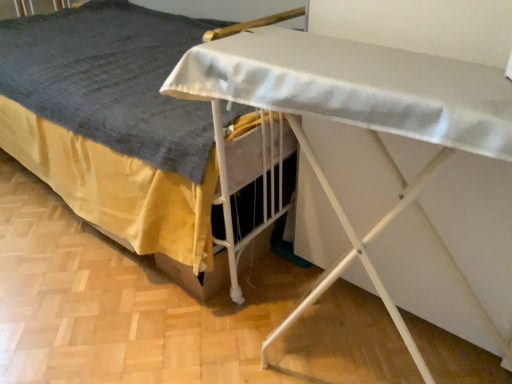
This screenshot has width=512, height=384. I want to click on white matte ironing board at lower center, so click(x=352, y=95).

What do you see at coordinates (352, 95) in the screenshot? The image size is (512, 384). I see `white matte ironing board at lower center` at bounding box center [352, 95].

What do you see at coordinates (116, 131) in the screenshot?
I see `white fabric bed at center` at bounding box center [116, 131].

You are a GUI agent. You are given a task and a screenshot of the screen. Output one action in this format:
    pyautogui.click(x=<x>, y=<y>)
    Task: Click on the white fabric bed at center
    The width and height of the screenshot is (512, 384).
    Given the screenshot: What is the action you would take?
    pyautogui.click(x=116, y=131)

I want to click on white matte ironing board at lower center, so click(352, 95).

Considering the positions of objects white matte ironing board at lower center and white fabric bed at center in the image provided, who is more to the left, white matte ironing board at lower center or white fabric bed at center?

From the viewer's perspective, white fabric bed at center appears more on the left side.

From the picture: In the image, is white matte ironing board at lower center positioned in front of or behind white fabric bed at center?

In the image, white matte ironing board at lower center appears in front of white fabric bed at center.

Does point (364, 240) appear closer or farther from the camera than point (161, 195)?

Point (364, 240) is positioned closer to the camera compared to point (161, 195).

From the image's perspective, which object appears higher, white matte ironing board at lower center or white fabric bed at center?

white fabric bed at center, from the image's perspective.

From a real-world perspective, between white matte ironing board at lower center and white fabric bed at center, who is vertically higher?

white fabric bed at center is physically above.

Does white matte ironing board at lower center have a lesser width compared to white fabric bed at center?

No, white matte ironing board at lower center is not thinner than white fabric bed at center.

From their relative heights in the image, would you say white matte ironing board at lower center is taller or shorter than white fabric bed at center?

white matte ironing board at lower center is shorter than white fabric bed at center.

Considering the sizes of objects white matte ironing board at lower center and white fabric bed at center in the image provided, who is smaller, white matte ironing board at lower center or white fabric bed at center?

With smaller size is white matte ironing board at lower center.

Is white matte ironing board at lower center located outside white fabric bed at center?

No, white matte ironing board at lower center is not entirely external to white fabric bed at center.

Is white matte ironing board at lower center directly adjacent to white fabric bed at center?

No, white matte ironing board at lower center is not beside white fabric bed at center.

Is white matte ironing board at lower center facing away from white fabric bed at center?

That's right, white matte ironing board at lower center is facing away from white fabric bed at center.

I want to click on table that is below the white fabric bed at center (from the image's perspective), so click(352, 95).

Which object is positioned more to the right, white fabric bed at center or white matte ironing board at lower center?

Positioned to the right is white matte ironing board at lower center.

Which object is closer to the camera, white fabric bed at center or white matte ironing board at lower center?

white matte ironing board at lower center is more forward.

Which is in front, point (233, 294) or point (242, 26)?

Positioned in front is point (242, 26).

From the image's perspective, does white fabric bed at center appear higher than white matte ironing board at lower center?

Indeed, from the image's perspective, white fabric bed at center is shown above white matte ironing board at lower center.

From a real-world perspective, which is physically below, white fabric bed at center or white matte ironing board at lower center?

white matte ironing board at lower center is physically lower.

Considering the relative sizes of white fabric bed at center and white matte ironing board at lower center in the image provided, is white fabric bed at center wider than white matte ironing board at lower center?

No, white fabric bed at center is not wider than white matte ironing board at lower center.

Between white fabric bed at center and white matte ironing board at lower center, which one has less height?

white matte ironing board at lower center is shorter.

Which of these two, white fabric bed at center or white matte ironing board at lower center, is smaller?

white matte ironing board at lower center is smaller.

Does white fabric bed at center contain white matte ironing board at lower center?

Yes, white matte ironing board at lower center is inside white fabric bed at center.

Would you say white fabric bed at center is a long distance from white matte ironing board at lower center?

That's not correct — white fabric bed at center is a little close to white matte ironing board at lower center.

Is white fabric bed at center facing away from white matte ironing board at lower center?

No, white fabric bed at center is not facing away from white matte ironing board at lower center.

Find the location of a particular element. The height and width of the screenshot is (384, 512). bed on the left of white matte ironing board at lower center is located at coordinates (116, 131).

Locate an element on the screen. This screenshot has height=384, width=512. bed behind the white matte ironing board at lower center is located at coordinates (116, 131).

Image resolution: width=512 pixels, height=384 pixels. What are the coordinates of `bed that appears on the left of white matte ironing board at lower center` in the screenshot? It's located at (116, 131).